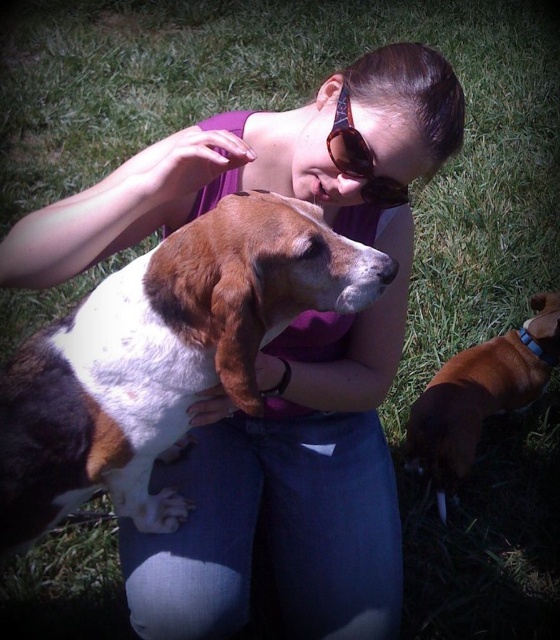
Does brown smooth dog at lower right appear on the left side of sunglasses at center?

In fact, brown smooth dog at lower right is to the right of sunglasses at center.

Between brown smooth dog at lower right and sunglasses at center, which one has more height?

brown smooth dog at lower right

Identify the location of brown smooth dog at lower right. (479, 396).

The height and width of the screenshot is (640, 560). Identify the location of brown smooth dog at lower right. (479, 396).

Is brown and white fur dog at center to the left of brown smooth dog at lower right from the viewer's perspective?

Correct, you'll find brown and white fur dog at center to the left of brown smooth dog at lower right.

Is point (44, 340) positioned behind point (478, 417)?

No, (44, 340) is closer to viewer.

You are a GUI agent. You are given a task and a screenshot of the screen. Output one action in this format:
    pyautogui.click(x=<x>, y=<y>)
    Task: Click on the brown and white fur dog at center
    This screenshot has width=560, height=640.
    Given the screenshot: What is the action you would take?
    pyautogui.click(x=162, y=356)

Which of these two, brown and white fur dog at center or sunglasses at center, stands taller?

With more height is brown and white fur dog at center.

Is brown and white fur dog at center wider than sunglasses at center?

Yes, brown and white fur dog at center is wider than sunglasses at center.

Is point (347, 278) positioned behind point (356, 156)?

That is False.

The height and width of the screenshot is (640, 560). I want to click on brown and white fur dog at center, so click(x=162, y=356).